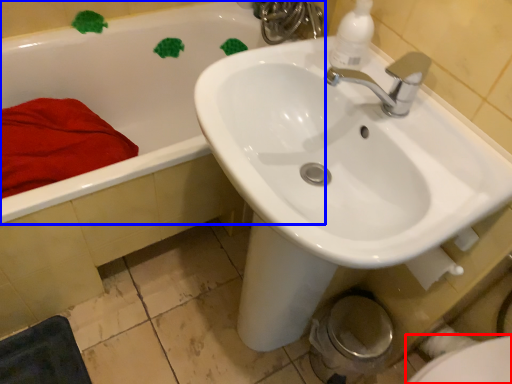
Question: Which object appears closest to the camera in this image, bidet (highlighted by a red box) or bathtub (highlighted by a blue box)?

Choices:
 (A) bidet
 (B) bathtub

Answer: (A)